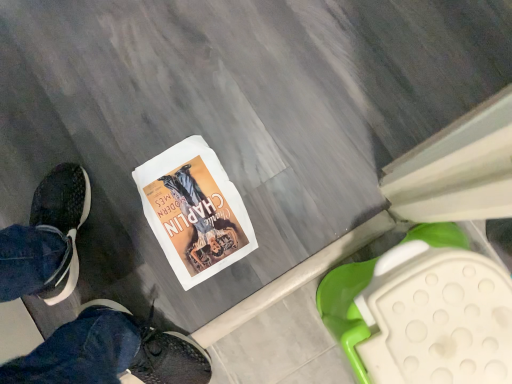
You are a GUI agent. You are given a task and a screenshot of the screen. Output one action in this format:
    pyautogui.click(x=<x>, y=<y>)
    Task: Click on the vacant area that is in front of white paper comic book at center
    
    Given the screenshot: What is the action you would take?
    pyautogui.click(x=244, y=279)